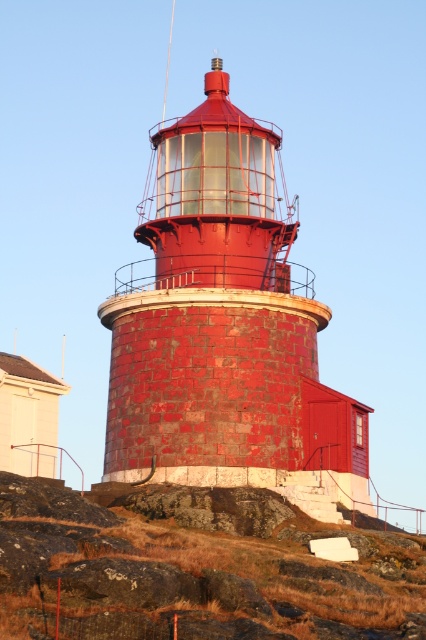
Based on the photo, does rusty metal lighthouse at center have a greater height compared to brown rough rock at lower center?

Correct, rusty metal lighthouse at center is much taller as brown rough rock at lower center.

This screenshot has height=640, width=426. What do you see at coordinates (226, 330) in the screenshot?
I see `rusty metal lighthouse at center` at bounding box center [226, 330].

Find the location of a particular element. This screenshot has height=640, width=426. rusty metal lighthouse at center is located at coordinates (226, 330).